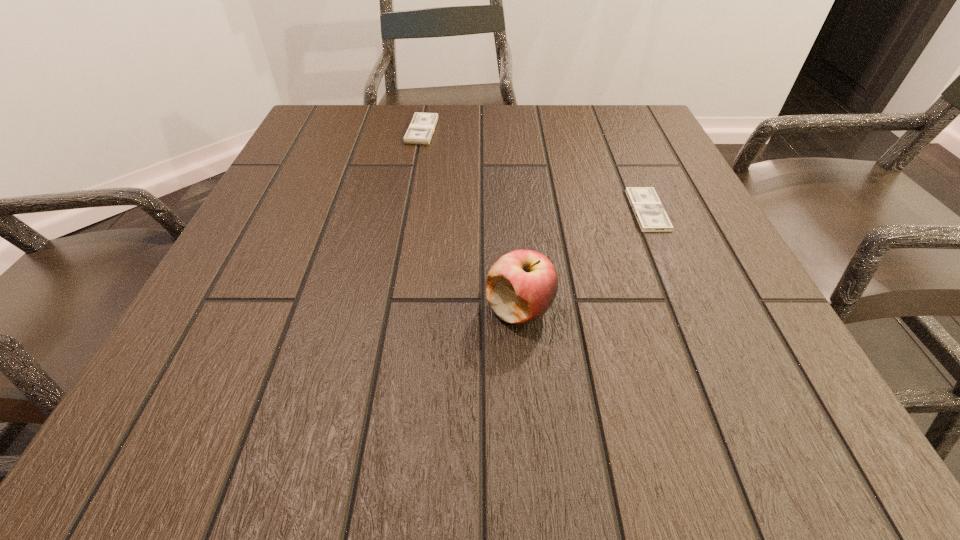
The height and width of the screenshot is (540, 960). Identify the location of the second object from left to right. (521, 286).

Locate an element on the screen. Image resolution: width=960 pixels, height=540 pixels. apple is located at coordinates (521, 286).

Find the location of `the farthest object`. the farthest object is located at coordinates (422, 126).

Locate an element on the screen. The image size is (960, 540). the leftmost object is located at coordinates (422, 126).

Where is `the second nearest object`? Image resolution: width=960 pixels, height=540 pixels. the second nearest object is located at coordinates (648, 209).

Identify the location of the shorter dollar. This screenshot has height=540, width=960. (648, 209).

Locate an element on the screen. The image size is (960, 540). vacant space located on the back of the second object from right to left is located at coordinates (511, 199).

Where is `free location located 0.300m on the right of the leftmost object`? The image size is (960, 540). free location located 0.300m on the right of the leftmost object is located at coordinates (562, 131).

Where is `vacant space situated on the left of the rightmost object`? This screenshot has height=540, width=960. vacant space situated on the left of the rightmost object is located at coordinates (581, 210).

Find the location of a particular element. object at the far edge is located at coordinates (422, 126).